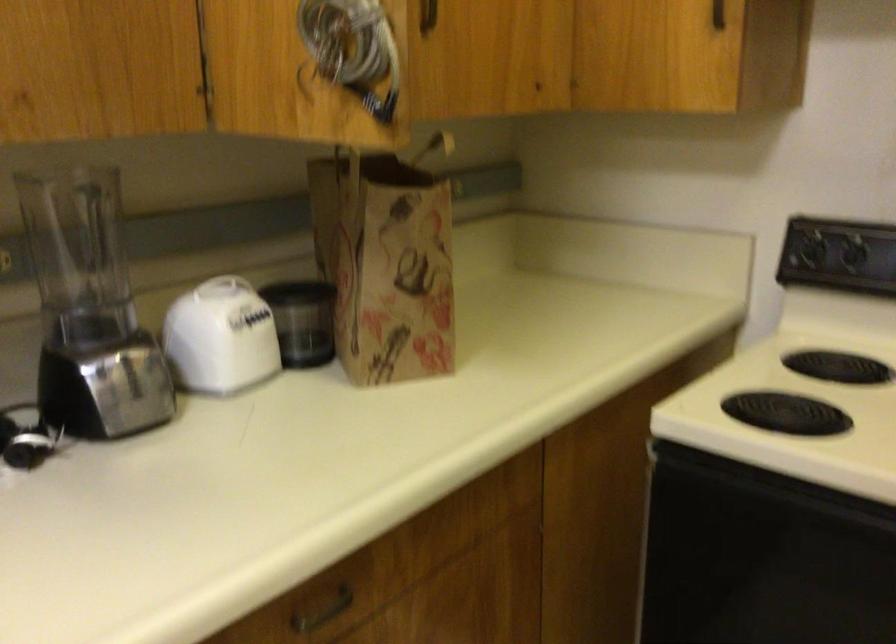
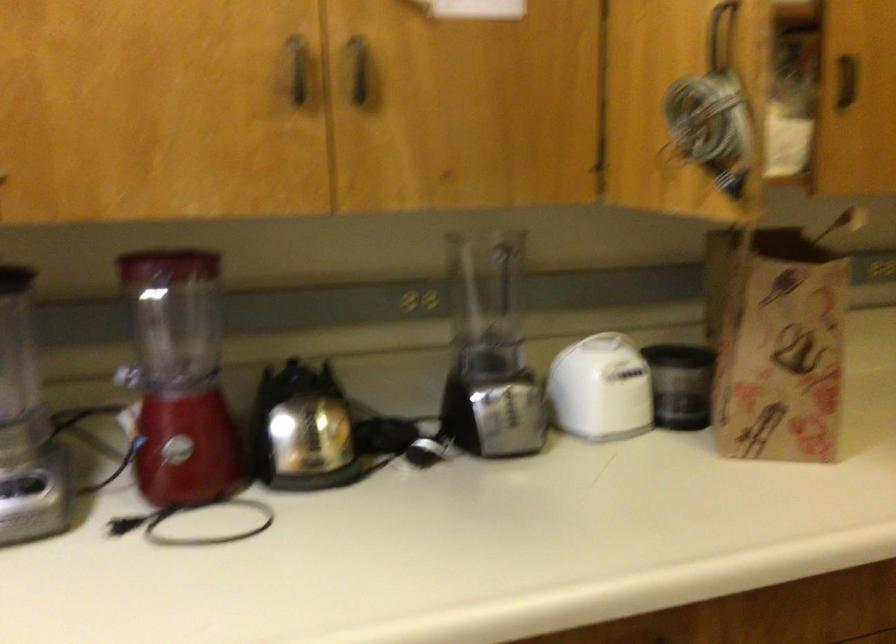
In the second image, find the point that corresponds to point (99, 321) in the first image.

(489, 351)